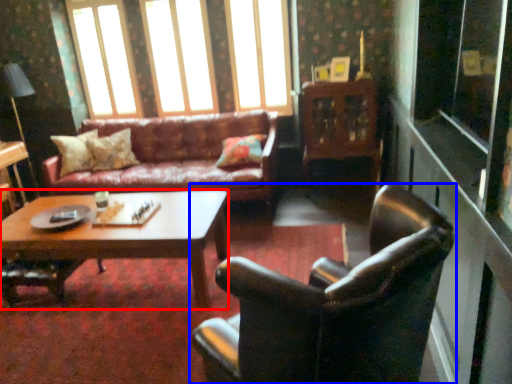
Question: Which of the following is the closest to the observer, coffee table (highlighted by a red box) or chair (highlighted by a blue box)?

Choices:
 (A) coffee table
 (B) chair

Answer: (B)